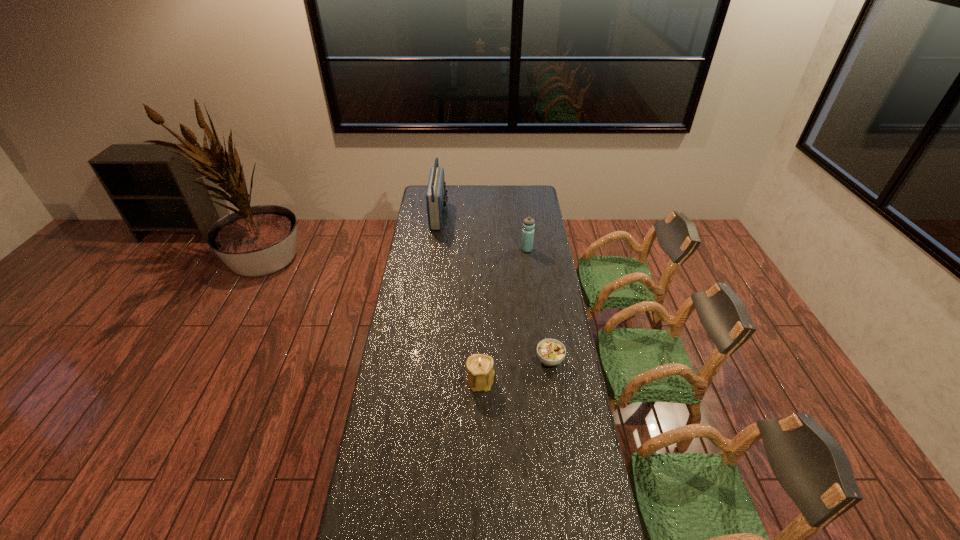
This screenshot has width=960, height=540. Identify the location of free space that satisfies the following two spatial constraints: 1. on the front panel of the leftmost object; 2. on the right side of the second shortest object. (419, 380).

This screenshot has height=540, width=960. In order to click on free location that satisfies the following two spatial constraints: 1. on the front panel of the tallest object; 2. on the back side of the soup bowl in this screenshot , I will do `click(420, 360)`.

Where is `free space that satisfies the following two spatial constraints: 1. on the front panel of the farthest object; 2. on the back side of the third nearest object`? The image size is (960, 540). free space that satisfies the following two spatial constraints: 1. on the front panel of the farthest object; 2. on the back side of the third nearest object is located at coordinates (435, 249).

In order to click on vacant space that satisfies the following two spatial constraints: 1. on the front panel of the leftmost object; 2. on the right side of the shortest object in this screenshot , I will do 420,360.

Identify the location of free space that satisfies the following two spatial constraints: 1. on the front panel of the farthest object; 2. on the right side of the second object from left to right. This screenshot has width=960, height=540. (419, 380).

You are a GUI agent. You are given a task and a screenshot of the screen. Output one action in this format:
    pyautogui.click(x=<x>, y=<y>)
    Task: Click on the free space in the image that satisfies the following two spatial constraints: 1. on the front panel of the tallest object; 2. on the left side of the shortest object
    
    Given the screenshot: What is the action you would take?
    pyautogui.click(x=420, y=360)

The width and height of the screenshot is (960, 540). I want to click on free space that satisfies the following two spatial constraints: 1. on the front panel of the leftmost object; 2. on the back side of the second farthest object, so click(x=435, y=249).

Locate an element on the screen. Image resolution: width=960 pixels, height=540 pixels. vacant region that satisfies the following two spatial constraints: 1. on the back side of the second shortest object; 2. on the left side of the third nearest object is located at coordinates (480, 249).